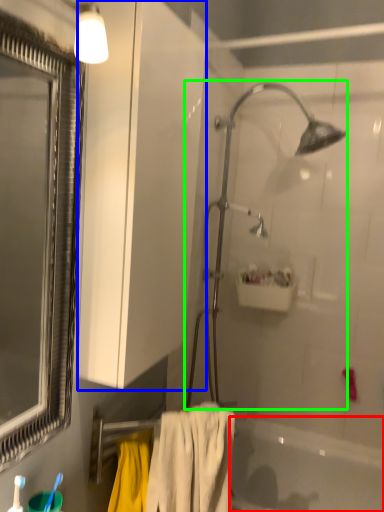
Question: Which object is positioned farthest from bathtub (highlighted by a red box)? Select from screen door (highlighted by a blue box) and shower (highlighted by a green box).

Choices:
 (A) screen door
 (B) shower

Answer: (A)